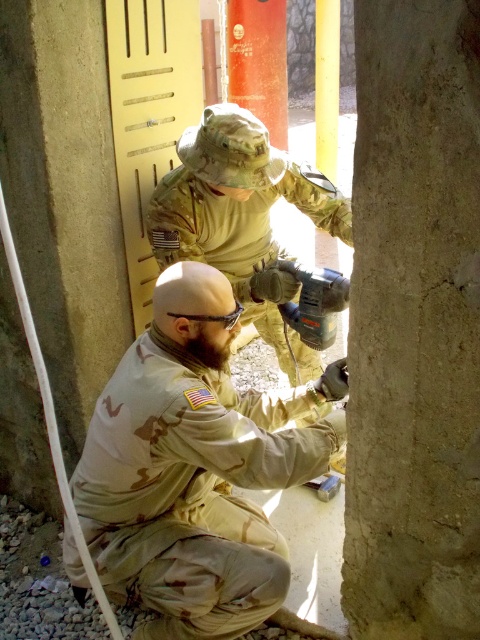
Question: Does tan camouflage uniform at center appear on the left side of camouflage uniform at center?

Choices:
 (A) yes
 (B) no

Answer: (A)

Question: Is tan camouflage uniform at center positioned before metallic gray drill at center?

Choices:
 (A) no
 (B) yes

Answer: (B)

Question: Does camouflage uniform at center appear on the left side of metallic gray drill at center?

Choices:
 (A) no
 (B) yes

Answer: (B)

Question: Which point is closer to the camera?

Choices:
 (A) camouflage uniform at center
 (B) tan camouflage uniform at center
 (C) metallic gray drill at center

Answer: (B)

Question: Which is nearer to the tan camouflage uniform at center?

Choices:
 (A) camouflage uniform at center
 (B) metallic gray drill at center

Answer: (B)

Question: Which object appears closest to the camera in this image?

Choices:
 (A) camouflage uniform at center
 (B) metallic gray drill at center

Answer: (B)